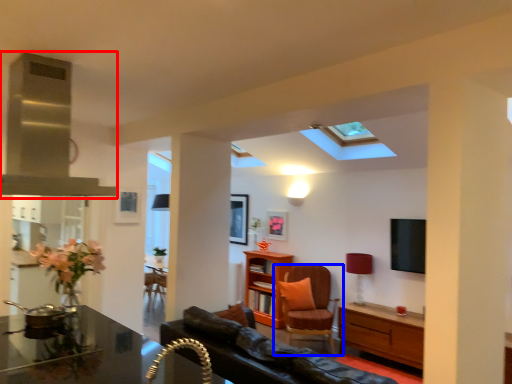
Question: Which object is further to the camera taking this photo, exhaust hood (highlighted by a red box) or chair (highlighted by a blue box)?

Choices:
 (A) exhaust hood
 (B) chair

Answer: (B)